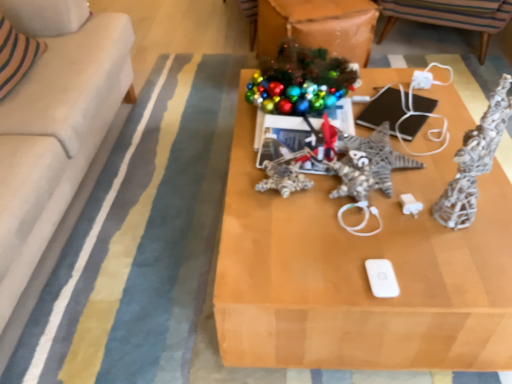
Question: In terms of size, does white fabric couch at left appear bigger or smaller than white matte ipod at center?

Choices:
 (A) big
 (B) small

Answer: (A)

Question: From the image's perspective, is white fabric couch at left above or below white matte ipod at center?

Choices:
 (A) above
 (B) below

Answer: (A)

Question: Estimate the real-world distances between objects in this image. Which object is closer to the striped fabric chair at upper center?

Choices:
 (A) wooden table at center
 (B) white matte ipod at center
 (C) white fabric couch at left

Answer: (A)

Question: Which object is the farthest from the white fabric couch at left?

Choices:
 (A) white matte ipod at center
 (B) striped fabric chair at upper center
 (C) wooden table at center

Answer: (B)